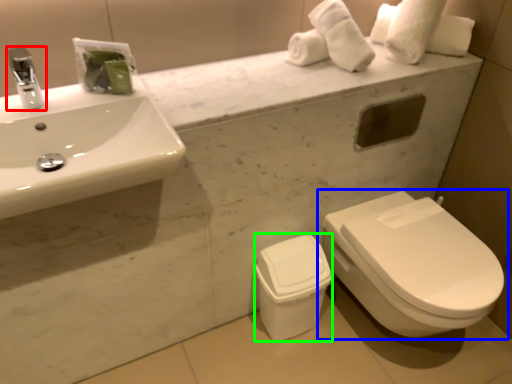
Question: Based on their relative distances, which object is farther from tap (highlighted by a red box)? Choose from toilet (highlighted by a blue box) and porcelain (highlighted by a green box).

Choices:
 (A) toilet
 (B) porcelain

Answer: (A)